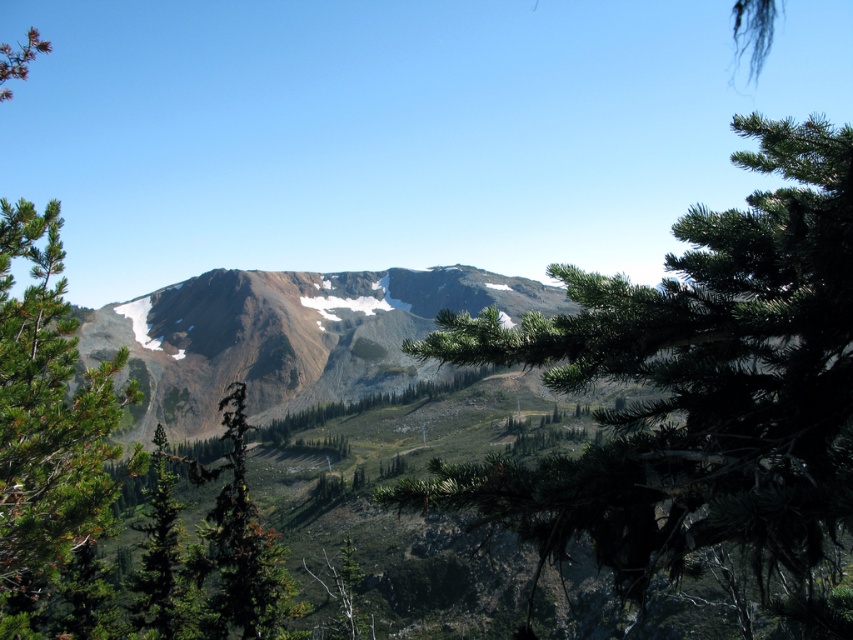
Between green needle-like branches at center and green needle-like tree at left, which one has more height?

With more height is green needle-like branches at center.

Measure the distance between green needle-like branches at center and camera.

green needle-like branches at center and camera are 14.35 meters apart from each other.

I want to click on green needle-like branches at center, so click(x=695, y=392).

The height and width of the screenshot is (640, 853). I want to click on green needle-like branches at center, so click(695, 392).

Which of these two, green needle-like tree at left or green matte tree at lower left, stands taller?

With more height is green needle-like tree at left.

The width and height of the screenshot is (853, 640). Find the location of `green needle-like tree at left`. green needle-like tree at left is located at coordinates (47, 424).

Is point (71, 337) in front of point (158, 502)?

Yes, it is.

At what (x,y) coordinates should I click in order to perform the action: click on green needle-like tree at left. Please return your answer as a coordinate pair (x, y). The height and width of the screenshot is (640, 853). Looking at the image, I should click on (47, 424).

Describe the element at coordinates (47, 424) in the screenshot. I see `green needle-like tree at left` at that location.

Is green needle-like tree at left below green leafy tree at center?

Incorrect, green needle-like tree at left is not positioned below green leafy tree at center.

Which is behind, point (42, 529) or point (245, 413)?

The point (245, 413) is more distant.

Image resolution: width=853 pixels, height=640 pixels. Identify the location of green needle-like tree at left. (47, 424).